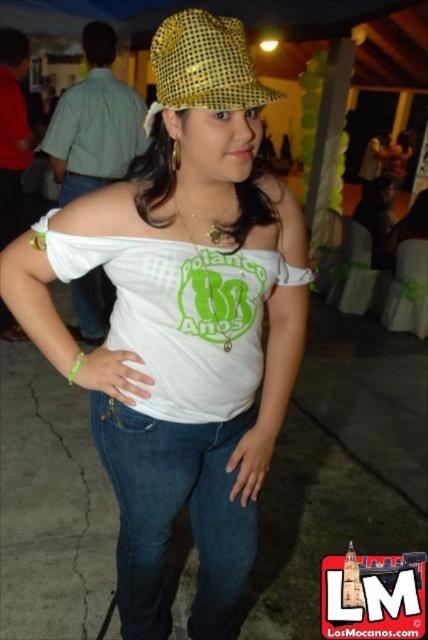
Question: Among these objects, which one is nearest to the camera?

Choices:
 (A) gold sequined baseball hat at upper center
 (B) blue denim jeans at left
 (C) white matte t-shirt at center
 (D) matte gold hat at upper center

Answer: (D)

Question: Can you confirm if white matte t-shirt at center is positioned above gold sequined baseball hat at upper center?

Choices:
 (A) no
 (B) yes

Answer: (A)

Question: Is matte gold hat at upper center wider than gold sequined baseball hat at upper center?

Choices:
 (A) yes
 (B) no

Answer: (A)

Question: Which point is closer to the camera?

Choices:
 (A) denim at left
 (B) white matte t-shirt at center
 (C) matte gold hat at upper center

Answer: (C)

Question: Where is denim at left located in relation to gold sequined baseball hat at upper center in the image?

Choices:
 (A) left
 (B) right

Answer: (A)

Question: Estimate the real-world distances between objects in this image. Which object is farther from the white matte t-shirt at center?

Choices:
 (A) matte gold hat at upper center
 (B) gold sequined baseball hat at upper center

Answer: (B)